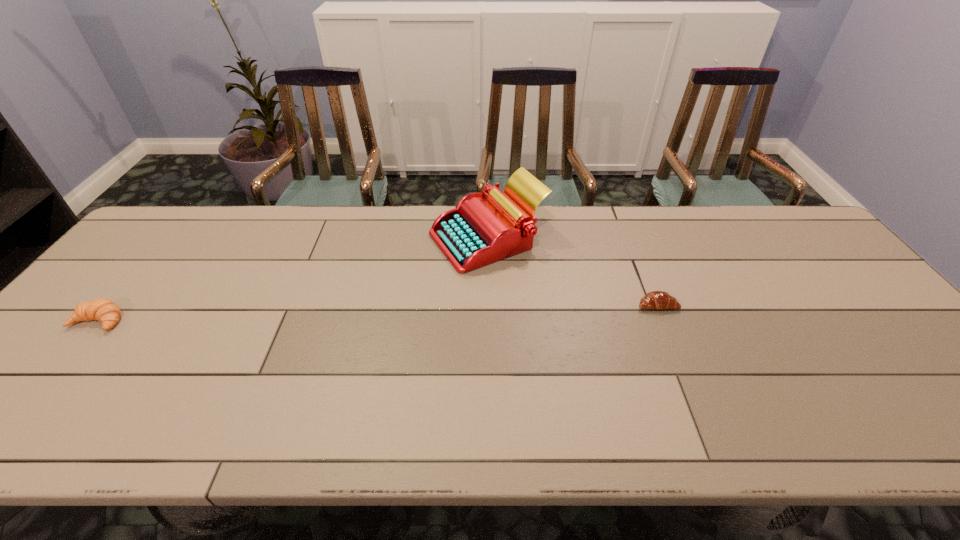
Find the location of a particular element. The image size is (960, 540). vacant area located on the right of the rightmost object is located at coordinates (757, 305).

I want to click on object that is at the far edge, so click(x=477, y=232).

This screenshot has width=960, height=540. What are the coordinates of `object located at the left edge` in the screenshot? It's located at (104, 310).

At what (x,y) coordinates should I click in order to perform the action: click on blank space at the far edge of the desktop. Please return your answer as a coordinate pair (x, y). Looking at the image, I should click on (688, 214).

Find the location of a particular element. The image size is (960, 540). vacant area at the near edge of the desktop is located at coordinates (588, 428).

I want to click on free space at the left edge, so click(149, 252).

You are a GUI agent. You are given a task and a screenshot of the screen. Output one action in this format:
    pyautogui.click(x=<x>, y=<y>)
    Task: Click on the vacant region at the right edge of the desktop
    This screenshot has height=540, width=960.
    Given the screenshot: What is the action you would take?
    click(822, 276)

Identify the location of vacant space at the far left corner of the desktop. The height and width of the screenshot is (540, 960). (138, 250).

Identify the location of free space that is in between the right crescent roll and the typewriter. (572, 272).

What are the coordinates of `vacant space that's between the second object from left to right and the taller crescent roll` in the screenshot? It's located at (294, 280).